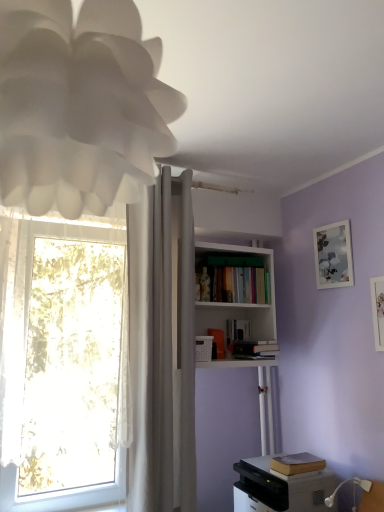
Question: Considering the relative sizes of white plastic remote control at upper center and hardcover book at upper center, acting as the fourth book starting from the bottom, in the image provided, is white plastic remote control at upper center shorter than hardcover book at upper center, acting as the fourth book starting from the bottom,?

Choices:
 (A) no
 (B) yes

Answer: (B)

Question: Does white plastic remote control at upper center have a greater width compared to hardcover book at upper center, acting as the fourth book starting from the bottom?

Choices:
 (A) no
 (B) yes

Answer: (A)

Question: Can you confirm if white plastic remote control at upper center is taller than hardcover book at upper center, which appears as the 2th book when viewed from the top?

Choices:
 (A) yes
 (B) no

Answer: (B)

Question: Is white plastic remote control at upper center not inside hardcover book at upper center, acting as the fourth book starting from the bottom?

Choices:
 (A) no
 (B) yes

Answer: (B)

Question: From the image's perspective, is white plastic remote control at upper center beneath hardcover book at upper center, acting as the fourth book starting from the bottom?

Choices:
 (A) yes
 (B) no

Answer: (B)

Question: From a real-world perspective, is white sheer curtain at left above or below white plastic remote control at upper center?

Choices:
 (A) above
 (B) below

Answer: (A)

Question: Considering the positions of point (89, 295) and point (195, 346), is point (89, 295) closer or farther from the camera than point (195, 346)?

Choices:
 (A) closer
 (B) farther

Answer: (A)

Question: In the image, is white sheer curtain at left positioned in front of or behind white plastic remote control at upper center?

Choices:
 (A) behind
 (B) front

Answer: (B)

Question: From the image's perspective, is white sheer curtain at left located above or below white plastic remote control at upper center?

Choices:
 (A) above
 (B) below

Answer: (A)

Question: From the image's perspective, is hardcover books at center, which is the 1th book in top-to-bottom order, located above or below hardcover book at upper center, which appears as the fourth book when viewed from the top?

Choices:
 (A) above
 (B) below

Answer: (A)

Question: In the image, is hardcover books at center, the 5th book positioned from the bottom, on the left side or the right side of hardcover book at upper center, which is counted as the 2th book, starting from the bottom?

Choices:
 (A) right
 (B) left

Answer: (B)

Question: Looking at their shapes, would you say hardcover books at center, the 5th book positioned from the bottom, is wider or thinner than hardcover book at upper center, which is counted as the 2th book, starting from the bottom?

Choices:
 (A) wide
 (B) thin

Answer: (B)

Question: Looking at the image, does hardcover books at center, which is the 1th book in top-to-bottom order, seem bigger or smaller compared to hardcover book at upper center, which is counted as the 2th book, starting from the bottom?

Choices:
 (A) big
 (B) small

Answer: (A)

Question: Is brown leather book at lower right, the first book positioned from the bottom, situated inside hardcover book at upper center, which is counted as the 2th book, starting from the bottom, or outside?

Choices:
 (A) inside
 (B) outside

Answer: (B)

Question: From a real-world perspective, is brown leather book at lower right, the first book positioned from the bottom, positioned above or below hardcover book at upper center, which appears as the fourth book when viewed from the top?

Choices:
 (A) below
 (B) above

Answer: (A)